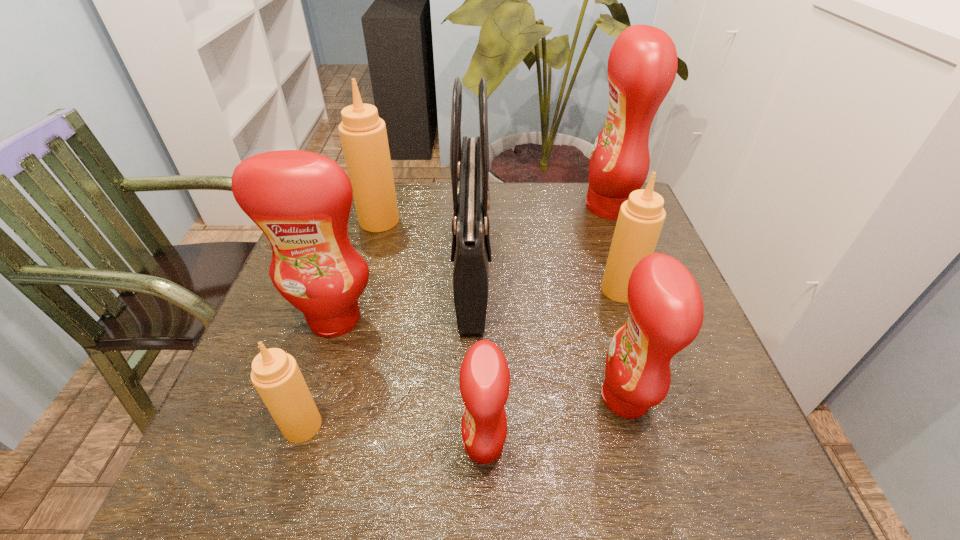
The width and height of the screenshot is (960, 540). Identify the location of vacant area in the image that satisfies the following two spatial constraints: 1. on the label side of the smallest tan condiment; 2. on the right side of the leftmost red condiment. (300, 426).